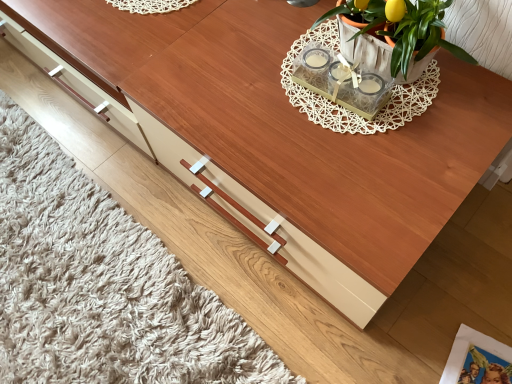
Question: Should I look upward or downward to see terracotta clay pot at upper right?

Choices:
 (A) down
 (B) up

Answer: (B)

Question: Can you confirm if terracotta clay pot at upper right is thinner than printed paper magazine at lower right?

Choices:
 (A) no
 (B) yes

Answer: (B)

Question: Could you tell me if terracotta clay pot at upper right is turned towards printed paper magazine at lower right?

Choices:
 (A) yes
 (B) no

Answer: (B)

Question: From a real-world perspective, is terracotta clay pot at upper right beneath printed paper magazine at lower right?

Choices:
 (A) yes
 (B) no

Answer: (B)

Question: Considering the relative positions of terracotta clay pot at upper right and printed paper magazine at lower right in the image provided, is terracotta clay pot at upper right to the right of printed paper magazine at lower right from the viewer's perspective?

Choices:
 (A) yes
 (B) no

Answer: (B)

Question: Is terracotta clay pot at upper right further to the viewer compared to printed paper magazine at lower right?

Choices:
 (A) yes
 (B) no

Answer: (B)

Question: Can you confirm if terracotta clay pot at upper right is smaller than printed paper magazine at lower right?

Choices:
 (A) yes
 (B) no

Answer: (B)

Question: Is there a large distance between printed paper magazine at lower right and terracotta clay pot at upper right?

Choices:
 (A) yes
 (B) no

Answer: (B)

Question: Can you confirm if printed paper magazine at lower right is smaller than terracotta clay pot at upper right?

Choices:
 (A) no
 (B) yes

Answer: (B)

Question: Does printed paper magazine at lower right turn towards terracotta clay pot at upper right?

Choices:
 (A) yes
 (B) no

Answer: (B)

Question: Is printed paper magazine at lower right facing away from terracotta clay pot at upper right?

Choices:
 (A) no
 (B) yes

Answer: (A)

Question: Does printed paper magazine at lower right have a lesser width compared to terracotta clay pot at upper right?

Choices:
 (A) no
 (B) yes

Answer: (A)

Question: Does printed paper magazine at lower right have a lesser height compared to terracotta clay pot at upper right?

Choices:
 (A) yes
 (B) no

Answer: (A)

Question: Is terracotta clay pot at upper right taller or shorter than printed paper magazine at lower right?

Choices:
 (A) short
 (B) tall

Answer: (B)